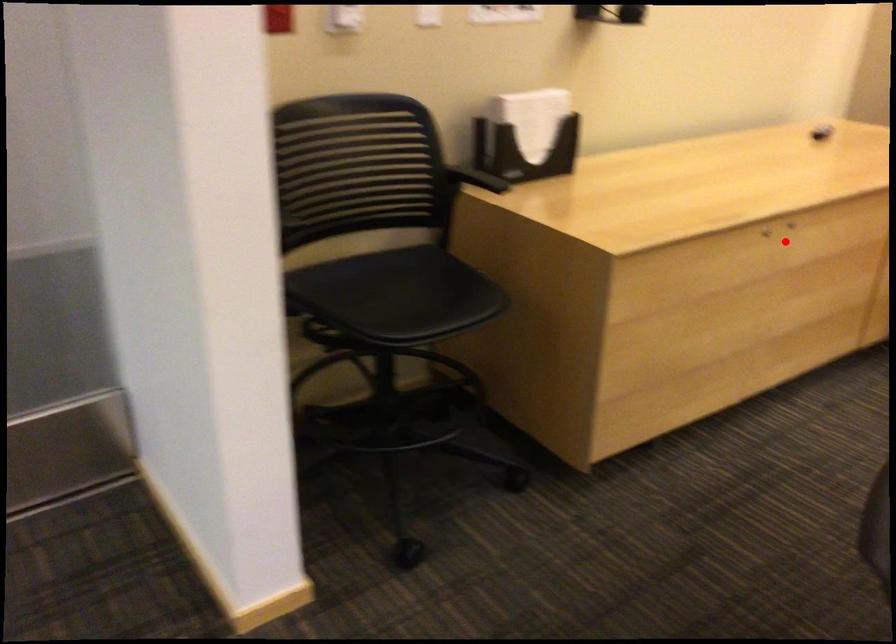
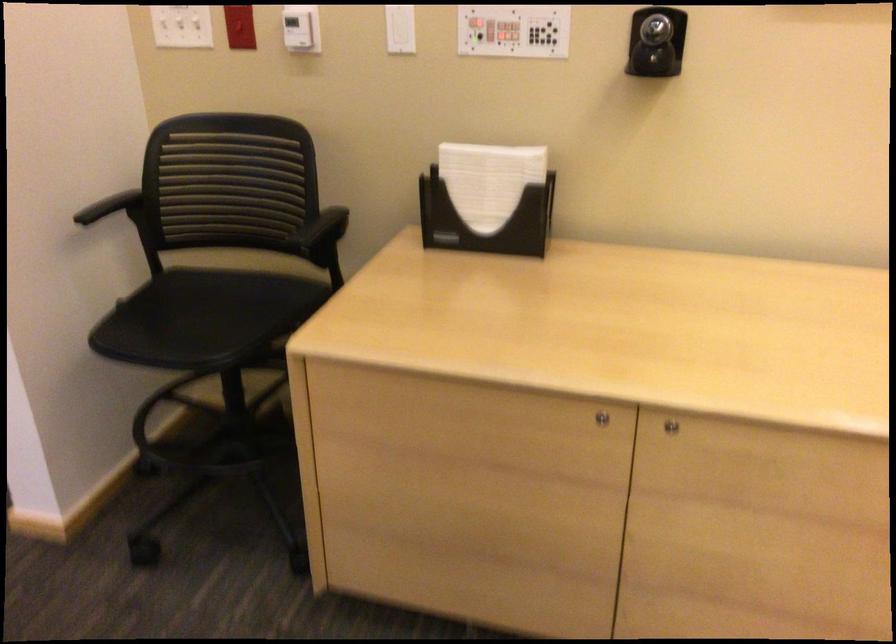
In the second image, find the point that corresponds to the highlighted location in the first image.

(670, 426)